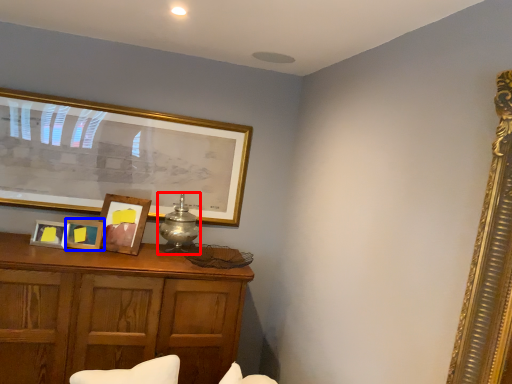
Question: Which point is further to the camera, table lamp (highlighted by a red box) or picture frame (highlighted by a blue box)?

Choices:
 (A) table lamp
 (B) picture frame

Answer: (A)